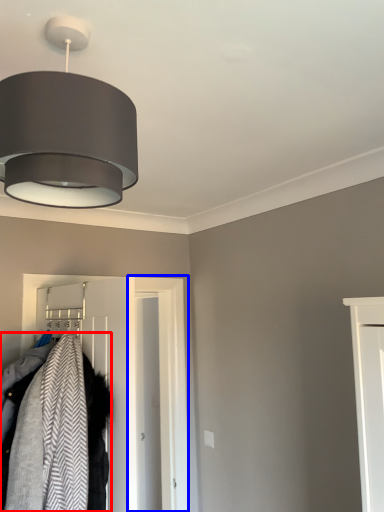
Question: Which object is further to the camera taking this photo, laundry (highlighted by a red box) or door (highlighted by a blue box)?

Choices:
 (A) laundry
 (B) door

Answer: (B)